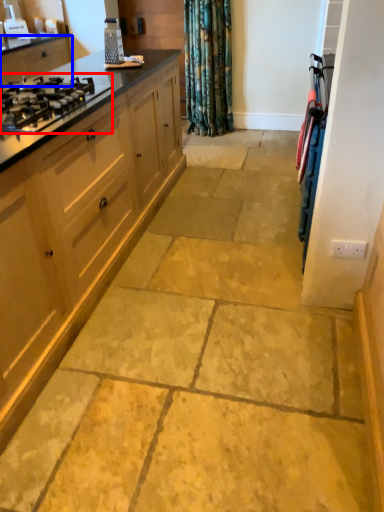
Question: Among these objects, which one is nearest to the camera, gas stove (highlighted by a red box) or cabinetry (highlighted by a blue box)?

Choices:
 (A) gas stove
 (B) cabinetry

Answer: (A)